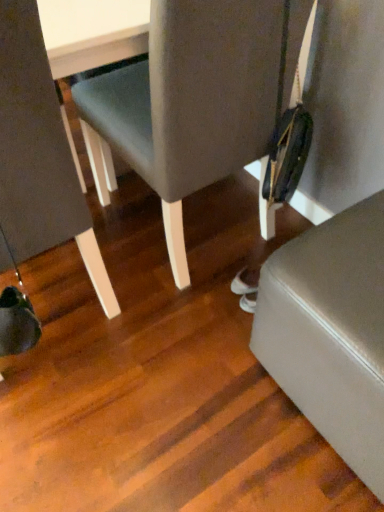
Question: From a real-world perspective, is matte gray chair at left, the 2th chair in the right-to-left sequence, on matte gray chair at center, the 2th chair in the left-to-right sequence?

Choices:
 (A) yes
 (B) no

Answer: (A)

Question: Does matte gray chair at left, the 2th chair in the right-to-left sequence, turn towards matte gray chair at center, the first chair positioned from the right?

Choices:
 (A) no
 (B) yes

Answer: (A)

Question: Are matte gray chair at left, positioned as the first chair in left-to-right order, and matte gray chair at center, the 2th chair in the left-to-right sequence, beside each other?

Choices:
 (A) no
 (B) yes

Answer: (A)

Question: Can you confirm if matte gray chair at left, positioned as the first chair in left-to-right order, is taller than matte gray chair at center, the first chair positioned from the right?

Choices:
 (A) yes
 (B) no

Answer: (A)

Question: Does matte gray chair at left, the 2th chair in the right-to-left sequence, have a greater width compared to matte gray chair at center, the first chair positioned from the right?

Choices:
 (A) no
 (B) yes

Answer: (B)

Question: From a real-world perspective, is matte gray chair at left, positioned as the first chair in left-to-right order, positioned above or below matte gray chair at center, the 2th chair in the left-to-right sequence?

Choices:
 (A) below
 (B) above

Answer: (B)

Question: Would you say matte gray chair at left, the 2th chair in the right-to-left sequence, is inside or outside matte gray chair at center, the first chair positioned from the right?

Choices:
 (A) inside
 (B) outside

Answer: (B)

Question: Would you say matte gray chair at left, the 2th chair in the right-to-left sequence, is to the left or to the right of matte gray chair at center, the 2th chair in the left-to-right sequence, in the picture?

Choices:
 (A) right
 (B) left

Answer: (B)

Question: Considering the positions of matte gray chair at left, positioned as the first chair in left-to-right order, and matte gray chair at center, the first chair positioned from the right, in the image, is matte gray chair at left, positioned as the first chair in left-to-right order, bigger or smaller than matte gray chair at center, the first chair positioned from the right,?

Choices:
 (A) small
 (B) big

Answer: (A)

Question: In the image, is matte gray chair at center, the 2th chair in the left-to-right sequence, positioned in front of or behind satin silver knife at lower right?

Choices:
 (A) front
 (B) behind

Answer: (B)

Question: From a real-world perspective, is matte gray chair at center, the first chair positioned from the right, above or below satin silver knife at lower right?

Choices:
 (A) above
 (B) below

Answer: (A)

Question: From the image's perspective, is matte gray chair at center, the 2th chair in the left-to-right sequence, located above or below satin silver knife at lower right?

Choices:
 (A) above
 (B) below

Answer: (A)

Question: Based on their sizes in the image, would you say matte gray chair at center, the first chair positioned from the right, is bigger or smaller than satin silver knife at lower right?

Choices:
 (A) small
 (B) big

Answer: (B)

Question: Is satin silver knife at lower right taller or shorter than matte gray chair at left, the 2th chair in the right-to-left sequence?

Choices:
 (A) short
 (B) tall

Answer: (A)

Question: Visually, is satin silver knife at lower right positioned to the left or to the right of matte gray chair at left, the 2th chair in the right-to-left sequence?

Choices:
 (A) left
 (B) right

Answer: (B)